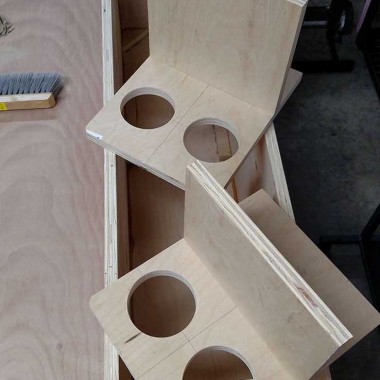
Locate an element on the screen. table is located at coordinates (345, 191).